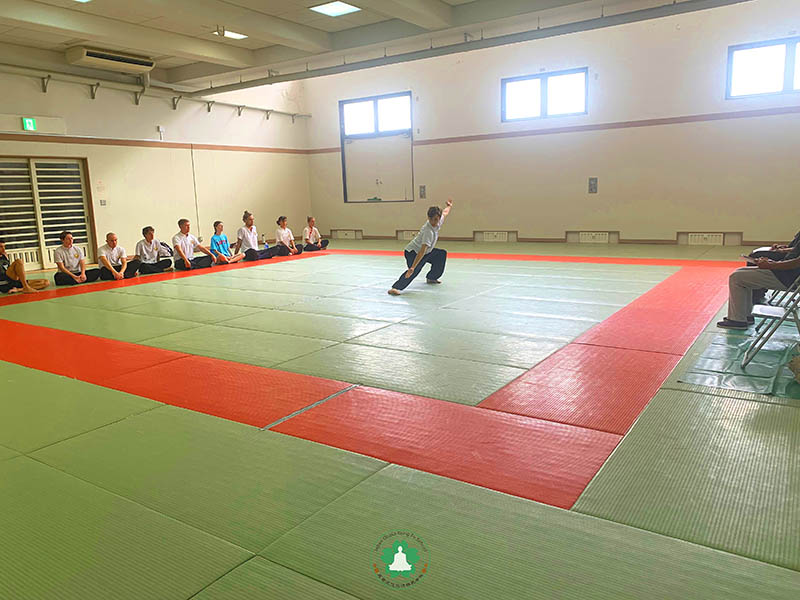
I want to click on martial arts room, so click(x=314, y=333).